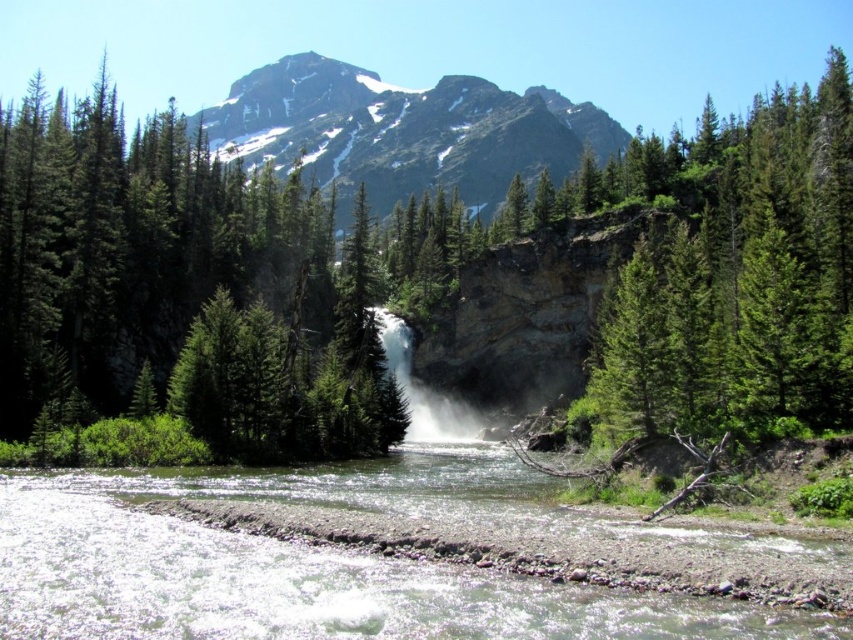
Question: Which point is closer to the camera taking this photo?

Choices:
 (A) [320, 166]
 (B) [585, 589]

Answer: (B)

Question: In this image, where is clear water at center located relative to snowy granite mountain at upper center?

Choices:
 (A) above
 (B) below

Answer: (B)

Question: Can you confirm if clear water at center is positioned to the right of snowy granite mountain at upper center?

Choices:
 (A) yes
 (B) no

Answer: (A)

Question: Which point is closer to the camera?

Choices:
 (A) snowy granite mountain at upper center
 (B) clear water at center

Answer: (B)

Question: Can you confirm if clear water at center is positioned below snowy granite mountain at upper center?

Choices:
 (A) no
 (B) yes

Answer: (B)

Question: Which point is closer to the camera?

Choices:
 (A) (25, 528)
 (B) (392, 122)

Answer: (A)